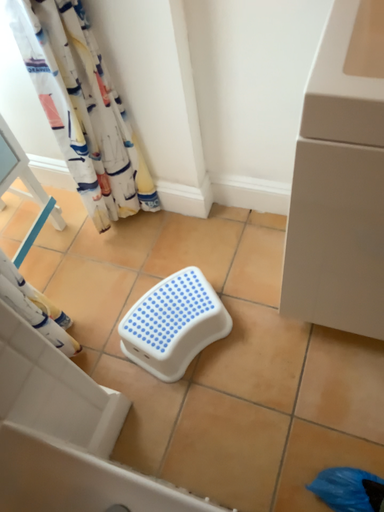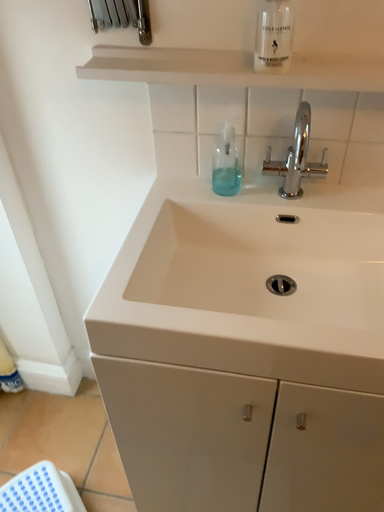
Question: How did the camera likely rotate when shooting the video?

Choices:
 (A) rotated left
 (B) rotated right

Answer: (B)